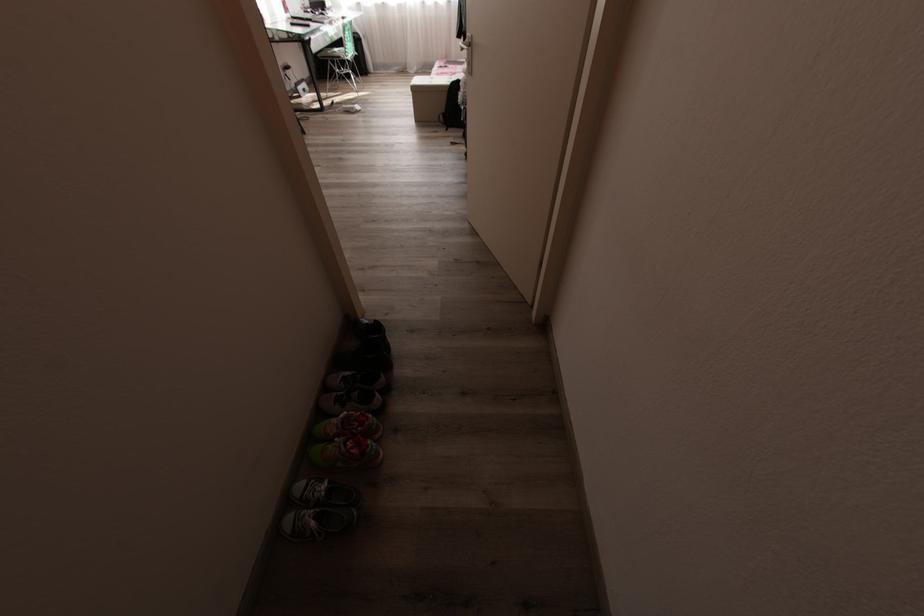
Find the location of a particular element. white storage box is located at coordinates (429, 98).